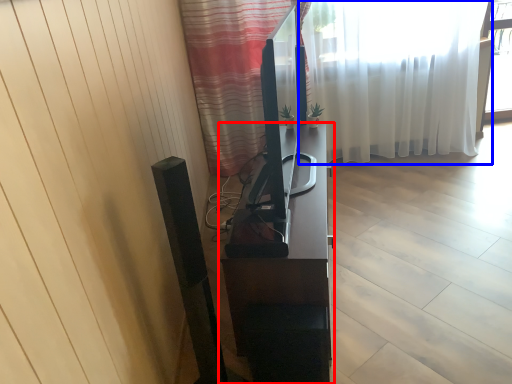
Question: Which of the following is the farthest to the observer, furniture (highlighted by a red box) or curtain (highlighted by a blue box)?

Choices:
 (A) furniture
 (B) curtain

Answer: (B)